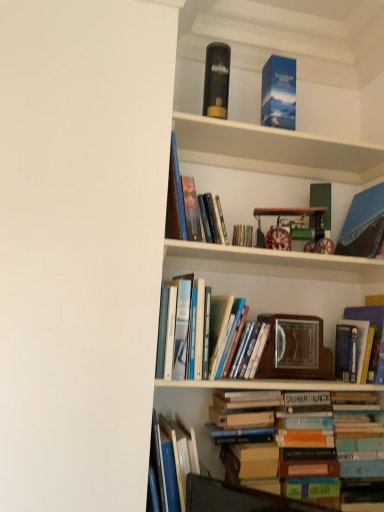
Question: Can you confirm if blue cardboard box at upper center is taller than hardcover book at lower center, the first book positioned from the bottom?

Choices:
 (A) no
 (B) yes

Answer: (A)

Question: Would you consider blue cardboard box at upper center to be distant from hardcover book at lower center, acting as the 8th book starting from the top?

Choices:
 (A) yes
 (B) no

Answer: (A)

Question: Is blue cardboard box at upper center positioned beyond the bounds of hardcover book at lower center, acting as the 8th book starting from the top?

Choices:
 (A) no
 (B) yes

Answer: (B)

Question: From the image's perspective, is blue cardboard box at upper center below hardcover book at lower center, the first book positioned from the bottom?

Choices:
 (A) no
 (B) yes

Answer: (A)

Question: Can hardcover book at lower center, acting as the 8th book starting from the top, be found inside blue cardboard box at upper center?

Choices:
 (A) yes
 (B) no

Answer: (B)

Question: From a real-world perspective, is blue cardboard box at upper center physically below hardcover book at lower center, the first book positioned from the bottom?

Choices:
 (A) yes
 (B) no

Answer: (B)

Question: Can you confirm if hardcover book at center, arranged as the 2th book when viewed from the top, is taller than hardcover book at center, which appears as the third book when ordered from the bottom?

Choices:
 (A) no
 (B) yes

Answer: (B)

Question: Considering the relative positions of hardcover book at center, positioned as the seventh book in bottom-to-top order, and hardcover book at center, positioned as the sixth book in top-to-bottom order, in the image provided, is hardcover book at center, positioned as the seventh book in bottom-to-top order, to the left of hardcover book at center, positioned as the sixth book in top-to-bottom order, from the viewer's perspective?

Choices:
 (A) no
 (B) yes

Answer: (B)

Question: Considering the relative sizes of hardcover book at center, arranged as the 2th book when viewed from the top, and hardcover book at center, positioned as the sixth book in top-to-bottom order, in the image provided, is hardcover book at center, arranged as the 2th book when viewed from the top, bigger than hardcover book at center, positioned as the sixth book in top-to-bottom order,?

Choices:
 (A) no
 (B) yes

Answer: (A)

Question: Can you confirm if hardcover book at center, positioned as the seventh book in bottom-to-top order, is shorter than hardcover book at center, which appears as the third book when ordered from the bottom?

Choices:
 (A) no
 (B) yes

Answer: (A)

Question: From a real-world perspective, is hardcover book at center, arranged as the 2th book when viewed from the top, positioned under hardcover book at center, positioned as the sixth book in top-to-bottom order, based on gravity?

Choices:
 (A) no
 (B) yes

Answer: (A)

Question: Does hardcover book at center, arranged as the 2th book when viewed from the top, lie in front of hardcover book at center, positioned as the sixth book in top-to-bottom order?

Choices:
 (A) no
 (B) yes

Answer: (A)

Question: Is hardcover book at center, positioned as the seventh book in bottom-to-top order, to the left of hardcover book at lower center, acting as the 8th book starting from the top, from the viewer's perspective?

Choices:
 (A) yes
 (B) no

Answer: (B)